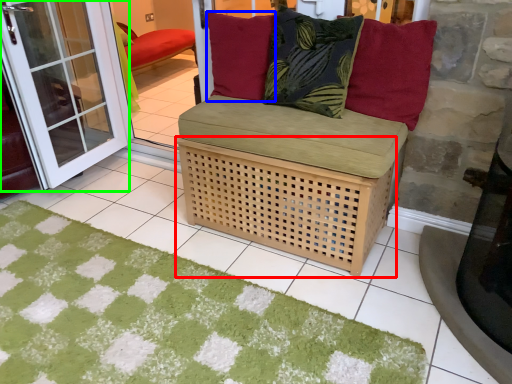
Question: Considering the real-world distances, which object is closest to basket (highlighted by a red box)? pillow (highlighted by a blue box) or screen door (highlighted by a green box).

Choices:
 (A) pillow
 (B) screen door

Answer: (A)